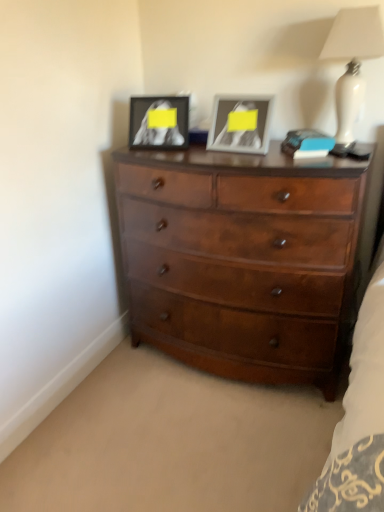
Identify the location of free space in front of blue matte book at upper right. This screenshot has height=512, width=384. (309, 169).